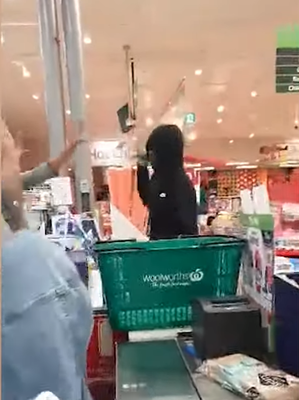
The image size is (299, 400). Identify the location of box. pos(288,246).